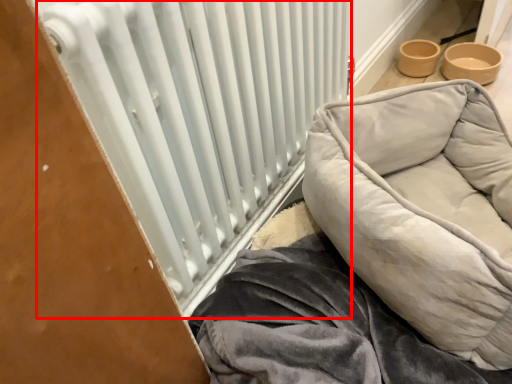
Question: Considering the relative positions of radiator (annotated by the red box) and furniture in the image provided, where is radiator (annotated by the red box) located with respect to the staircase?

Choices:
 (A) right
 (B) left

Answer: (B)